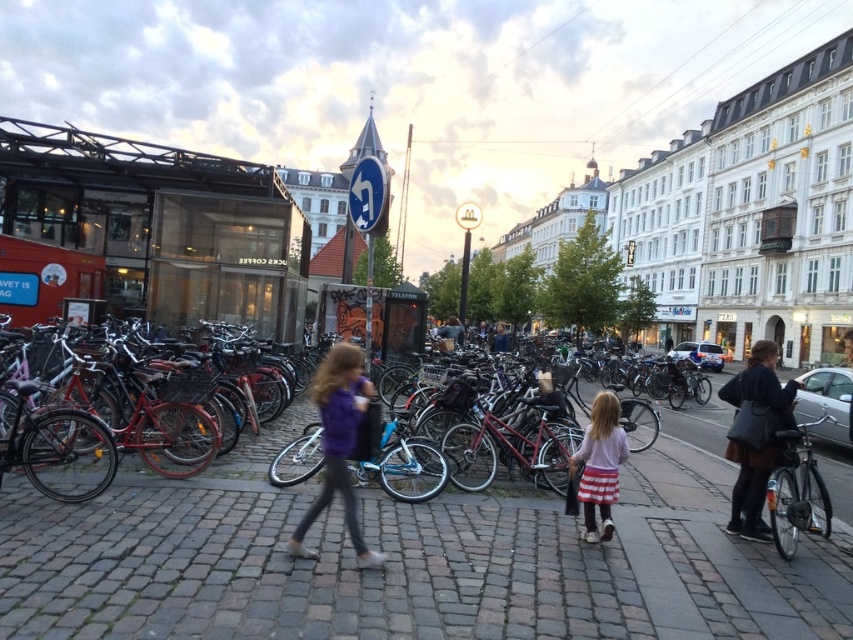
Question: Which point appears farthest from the camera in this image?

Choices:
 (A) (343, 356)
 (B) (601, 516)
 (C) (755, 368)

Answer: (C)

Question: Is cobblestone pavement at center to the right of shiny silver bicycle at right from the viewer's perspective?

Choices:
 (A) no
 (B) yes

Answer: (A)

Question: Based on their relative distances, which object is farther from the pink fabric skirt at center?

Choices:
 (A) shiny silver bicycle at right
 (B) purple fabric jacket at center

Answer: (B)

Question: Which point is farther to the camera?

Choices:
 (A) (335, 621)
 (B) (346, 420)

Answer: (B)

Question: Considering the relative positions of dark brown leather jacket at right and pink fabric skirt at center in the image provided, where is dark brown leather jacket at right located with respect to pink fabric skirt at center?

Choices:
 (A) above
 (B) below

Answer: (A)

Question: Is purple fabric jacket at center to the right of shiny silver bicycle at right from the viewer's perspective?

Choices:
 (A) no
 (B) yes

Answer: (A)